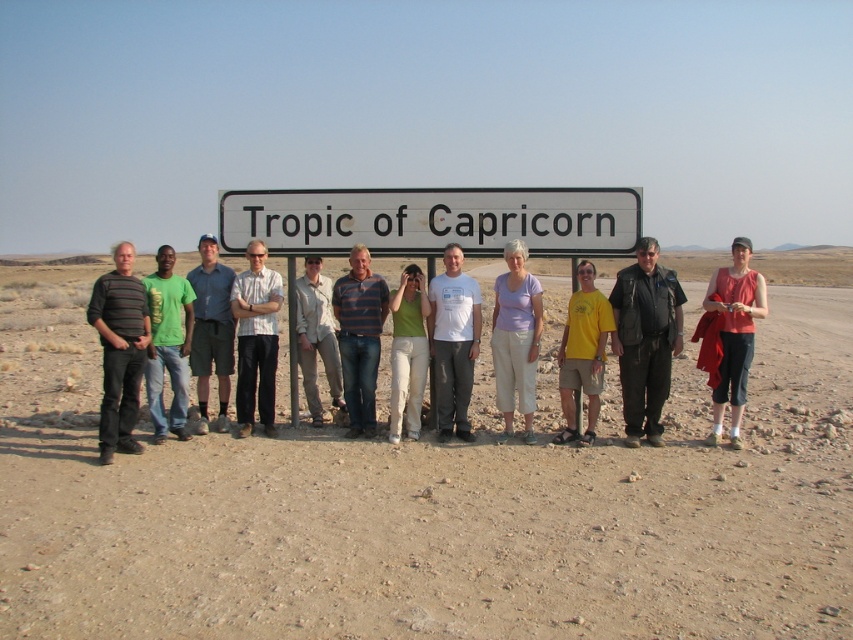
In the scene shown: You are a photographer trying to arrange the group so that the light purple cotton shirt at center and the green matte shirt at center are visible. Which shirt should be placed in front to ensure both are visible?

The green matte shirt at center should be placed in front because it is smaller than the light purple cotton shirt at center, allowing both to be visible.